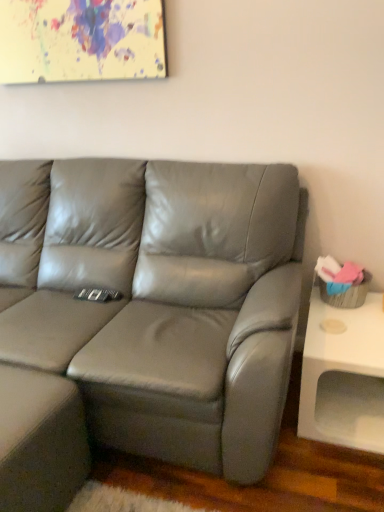
Question: Considering the positions of white matte table at right and satin gray leather couch at center in the image, is white matte table at right bigger or smaller than satin gray leather couch at center?

Choices:
 (A) big
 (B) small

Answer: (B)

Question: Is white matte table at right in front of or behind satin gray leather couch at center in the image?

Choices:
 (A) behind
 (B) front

Answer: (A)

Question: Estimate the real-world distances between objects in this image. Which object is closer to the white matte table at right?

Choices:
 (A) painted canvas at upper center
 (B) matte gray footrest at lower left
 (C) satin gray leather couch at center

Answer: (C)

Question: Estimate the real-world distances between objects in this image. Which object is closer to the white matte table at right?

Choices:
 (A) satin gray leather couch at center
 (B) painted canvas at upper center
 (C) matte gray footrest at lower left

Answer: (A)